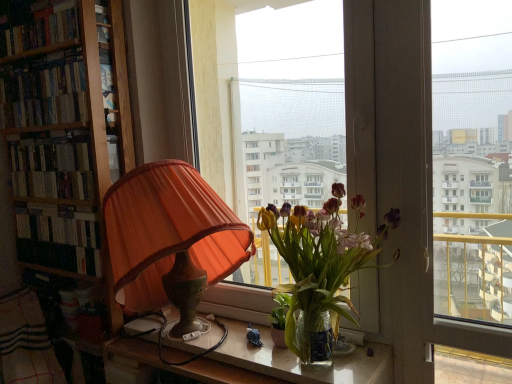
What are the coordinates of `vacant point above translucent glass table at lower center (from a real-world perspective)` in the screenshot? It's located at (234, 335).